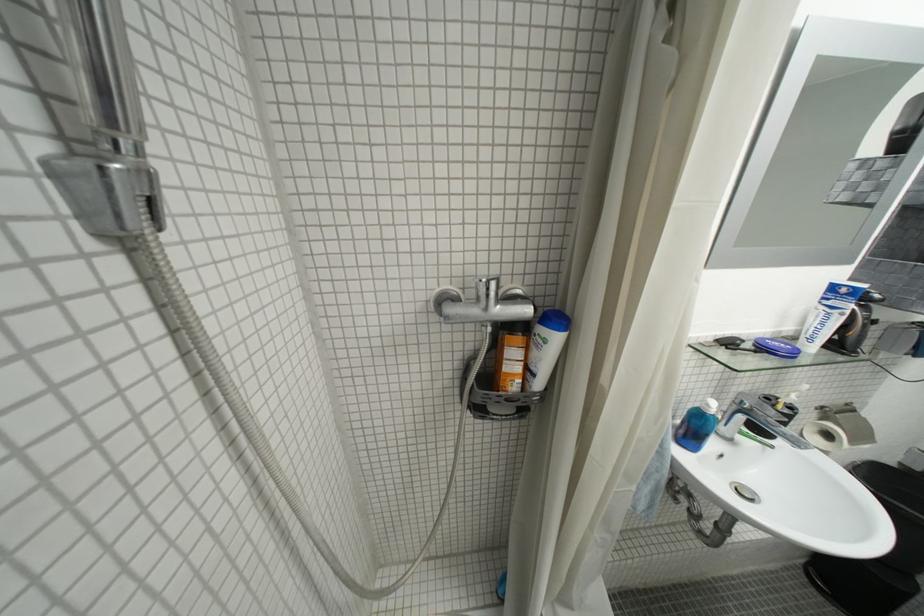
Locate an element on the screen. This screenshot has height=616, width=924. chrome shower head adjuster is located at coordinates (105, 191).